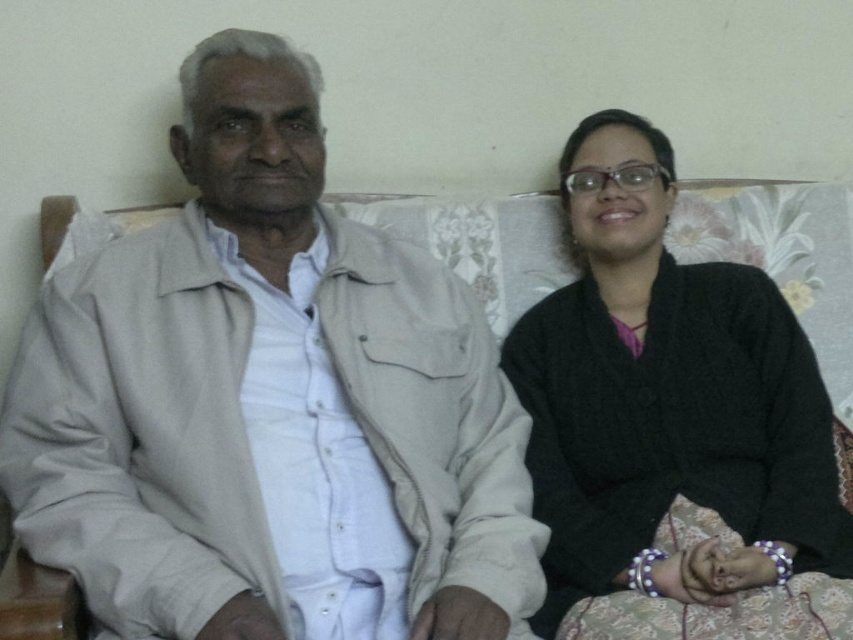
Question: Does light beige jacket at left have a lesser width compared to black knitted sweater at right?

Choices:
 (A) yes
 (B) no

Answer: (B)

Question: Where is light beige jacket at left located in relation to black knitted sweater at right in the image?

Choices:
 (A) above
 (B) below

Answer: (A)

Question: Which of the following is the farthest from the observer?

Choices:
 (A) black knitted sweater at right
 (B) light beige jacket at left

Answer: (A)

Question: Which of the following is the closest to the observer?

Choices:
 (A) coord(326,618)
 (B) coord(611,449)

Answer: (A)

Question: Is light beige jacket at left smaller than black knitted sweater at right?

Choices:
 (A) yes
 (B) no

Answer: (B)